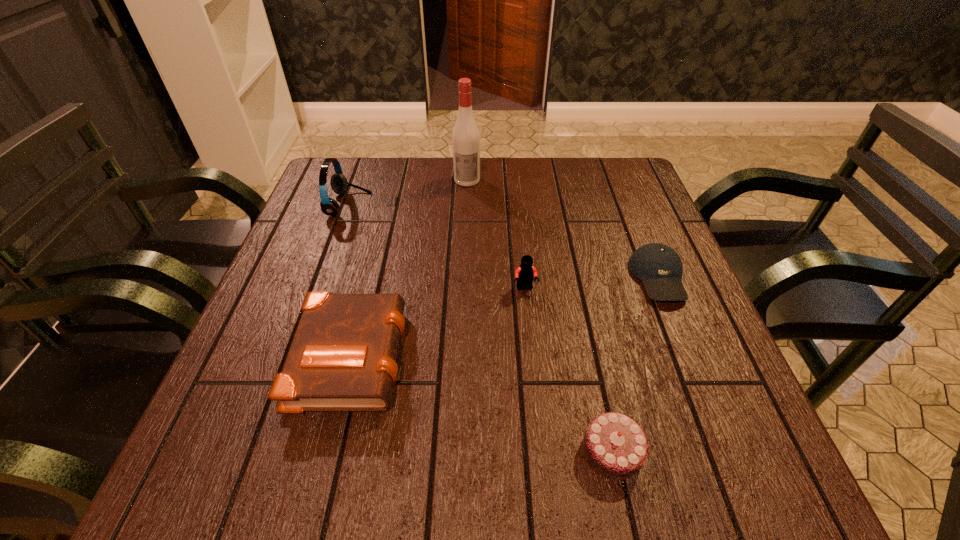
Locate an element on the screen. the tallest object is located at coordinates (465, 137).

Find the location of `the farthest object`. the farthest object is located at coordinates (465, 137).

Where is `headset`? headset is located at coordinates (339, 184).

At what (x,y) coordinates should I click in order to perform the action: click on the second farthest object. Please return your answer as a coordinate pair (x, y). Image resolution: width=960 pixels, height=540 pixels. Looking at the image, I should click on (339, 184).

Find the location of a particular element. the third tallest object is located at coordinates (524, 274).

The width and height of the screenshot is (960, 540). I want to click on Lego, so click(x=524, y=274).

Image resolution: width=960 pixels, height=540 pixels. I want to click on Bible, so click(x=343, y=356).

I want to click on the rightmost object, so click(x=658, y=266).

This screenshot has height=540, width=960. I want to click on chocolate cake, so click(615, 446).

Find the location of a particular element. The width and height of the screenshot is (960, 540). the second object from right to left is located at coordinates click(615, 446).